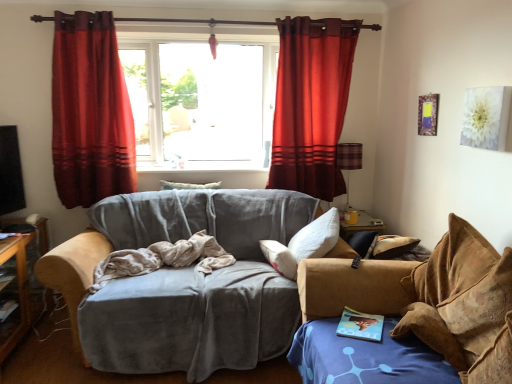
What do you see at coordinates (348, 162) in the screenshot?
I see `plaid fabric lampshade at right` at bounding box center [348, 162].

Where is `white soft pillow at center`? white soft pillow at center is located at coordinates (188, 185).

What is the approximate width of transparent glass window at center?

transparent glass window at center is 8.81 inches in width.

Locate an element on the screen. Image resolution: width=512 pixels, height=384 pixels. plaid fabric lampshade at right is located at coordinates (348, 162).

At what (x,y) coordinates should I click in order to perform the action: click on curtain on the right of transparent glass window at center. Please return your answer as a coordinate pair (x, y). Looking at the image, I should click on (311, 104).

Consider the image. Which of these two, transparent glass window at center or rich red velvet curtain at upper center, positioned as the 2th curtain in left-to-right order, is thinner?

rich red velvet curtain at upper center, positioned as the 2th curtain in left-to-right order, is thinner.

In the scene shown: From the image's perspective, is transparent glass window at center located beneath rich red velvet curtain at upper center, positioned as the 2th curtain in left-to-right order?

No, from the image's perspective, transparent glass window at center is not beneath rich red velvet curtain at upper center, positioned as the 2th curtain in left-to-right order.

In terms of width, does rich red velvet curtain at upper center, acting as the 1th curtain starting from the right, look wider or thinner when compared to velvet gray couch at center, acting as the 1th studio couch starting from the left?

Considering their sizes, rich red velvet curtain at upper center, acting as the 1th curtain starting from the right, looks slimmer than velvet gray couch at center, acting as the 1th studio couch starting from the left.

Is rich red velvet curtain at upper center, acting as the 1th curtain starting from the right, to the left of velvet gray couch at center, acting as the 1th studio couch starting from the left, from the viewer's perspective?

Incorrect, rich red velvet curtain at upper center, acting as the 1th curtain starting from the right, is not on the left side of velvet gray couch at center, acting as the 1th studio couch starting from the left.

Is rich red velvet curtain at upper center, acting as the 1th curtain starting from the right, looking in the opposite direction of velvet gray couch at center, acting as the 1th studio couch starting from the left?

No, rich red velvet curtain at upper center, acting as the 1th curtain starting from the right, is not facing the opposite direction of velvet gray couch at center, acting as the 1th studio couch starting from the left.

Is rich red velvet curtain at upper center, acting as the 1th curtain starting from the right, positioned beyond the bounds of velvet gray couch at center, the second studio couch viewed from the right?

rich red velvet curtain at upper center, acting as the 1th curtain starting from the right, lies outside velvet gray couch at center, the second studio couch viewed from the right,'s area.

Can you tell me how much brown suede studio couch at right, the first studio couch positioned from the right, and velvet gray couch at center, acting as the 1th studio couch starting from the left, differ in facing direction?

They differ by 89.7 degrees in their facing directions.

Considering the sizes of objects brown suede studio couch at right, which is the second studio couch in left-to-right order, and velvet gray couch at center, the second studio couch viewed from the right, in the image provided, who is thinner, brown suede studio couch at right, which is the second studio couch in left-to-right order, or velvet gray couch at center, the second studio couch viewed from the right,?

brown suede studio couch at right, which is the second studio couch in left-to-right order.

Where is `studio couch located in front of the velvet gray couch at center, acting as the 1th studio couch starting from the left`? studio couch located in front of the velvet gray couch at center, acting as the 1th studio couch starting from the left is located at coordinates (429, 299).

Which object is closer to the camera, brown suede studio couch at right, which is the second studio couch in left-to-right order, or velvet gray couch at center, the second studio couch viewed from the right?

Positioned in front is brown suede studio couch at right, which is the second studio couch in left-to-right order.

Consider the image. Which object is positioned more to the right, white soft pillow at center or rich red velvet curtain at upper center, acting as the 1th curtain starting from the right?

rich red velvet curtain at upper center, acting as the 1th curtain starting from the right, is more to the right.

Is white soft pillow at center wider than rich red velvet curtain at upper center, positioned as the 2th curtain in left-to-right order?

No.

Which is behind, point (178, 187) or point (304, 33)?

The point (178, 187) is more distant.

Is beige fabric blanket at center aimed at red velvet curtain at left, arranged as the second curtain when viewed from the right?

No.

Considering the sizes of beige fabric blanket at center and red velvet curtain at left, arranged as the second curtain when viewed from the right, in the image, is beige fabric blanket at center bigger or smaller than red velvet curtain at left, arranged as the second curtain when viewed from the right,?

Clearly, beige fabric blanket at center is smaller in size than red velvet curtain at left, arranged as the second curtain when viewed from the right.

The width and height of the screenshot is (512, 384). I want to click on curtain that is the 1st one when counting upward from the beige fabric blanket at center (from the image's perspective), so click(90, 111).

Does point (431, 255) appear closer or farther from the camera than point (183, 40)?

Clearly, point (431, 255) is closer to the camera than point (183, 40).

From a real-world perspective, who is located higher, brown suede studio couch at right, which is the second studio couch in left-to-right order, or transparent glass window at center?

transparent glass window at center.

In terms of size, does brown suede studio couch at right, which is the second studio couch in left-to-right order, appear bigger or smaller than transparent glass window at center?

brown suede studio couch at right, which is the second studio couch in left-to-right order, is bigger than transparent glass window at center.

How different are the orientations of brown suede studio couch at right, which is the second studio couch in left-to-right order, and transparent glass window at center in degrees?

There is a 88.8-degree angle between the facing directions of brown suede studio couch at right, which is the second studio couch in left-to-right order, and transparent glass window at center.

In the image, there is a brown suede studio couch at right, the first studio couch positioned from the right. Where is `material above it (from the image's perspective)`? This screenshot has height=384, width=512. material above it (from the image's perspective) is located at coordinates (162, 259).

Considering the sizes of objects brown suede studio couch at right, which is the second studio couch in left-to-right order, and beige fabric blanket at center in the image provided, who is taller, brown suede studio couch at right, which is the second studio couch in left-to-right order, or beige fabric blanket at center?

brown suede studio couch at right, which is the second studio couch in left-to-right order, is taller.

Is brown suede studio couch at right, the first studio couch positioned from the right, turned away from beige fabric blanket at center?

No, brown suede studio couch at right, the first studio couch positioned from the right,'s orientation is not away from beige fabric blanket at center.

Is brown suede studio couch at right, which is the second studio couch in left-to-right order, far away from beige fabric blanket at center?

Yes, brown suede studio couch at right, which is the second studio couch in left-to-right order, is far from beige fabric blanket at center.

There is a rich red velvet curtain at upper center, positioned as the 2th curtain in left-to-right order. Identify the location of window above it (from a real-world perspective). This screenshot has height=384, width=512. (201, 102).

At what (x,y) coordinates should I click in order to perform the action: click on studio couch that appears on the left of rich red velvet curtain at upper center, acting as the 1th curtain starting from the right. Please return your answer as a coordinate pair (x, y). Looking at the image, I should click on (183, 283).

Looking at the image, which one is located further to brown suede studio couch at right, the first studio couch positioned from the right, red velvet curtain at left, arranged as the second curtain when viewed from the right, or velvet gray couch at center, the second studio couch viewed from the right?

Based on the image, red velvet curtain at left, arranged as the second curtain when viewed from the right, appears to be further to brown suede studio couch at right, the first studio couch positioned from the right.

Looking at this image, when comparing their distances from red velvet curtain at left, arranged as the second curtain when viewed from the right, does velvet gray couch at center, the second studio couch viewed from the right, or plaid fabric lampshade at right seem closer?

The object closer to red velvet curtain at left, arranged as the second curtain when viewed from the right, is velvet gray couch at center, the second studio couch viewed from the right.

Estimate the real-world distances between objects in this image. Which object is further from rich red velvet curtain at upper center, acting as the 1th curtain starting from the right, red velvet curtain at left, marked as the first curtain in a left-to-right arrangement, or velvet gray couch at center, acting as the 1th studio couch starting from the left?

The object further to rich red velvet curtain at upper center, acting as the 1th curtain starting from the right, is red velvet curtain at left, marked as the first curtain in a left-to-right arrangement.

From the image, which object appears to be nearer to red velvet curtain at left, marked as the first curtain in a left-to-right arrangement, velvet gray couch at center, the second studio couch viewed from the right, or beige fabric blanket at center?

Among the two, velvet gray couch at center, the second studio couch viewed from the right, is located nearer to red velvet curtain at left, marked as the first curtain in a left-to-right arrangement.

When comparing their distances from transparent glass window at center, does rich red velvet curtain at upper center, acting as the 1th curtain starting from the right, or beige fabric blanket at center seem closer?

rich red velvet curtain at upper center, acting as the 1th curtain starting from the right, is closer to transparent glass window at center.

In the scene shown: Based on their spatial positions, is white soft pillow at center or beige fabric blanket at center closer to transparent glass window at center?

Based on the image, white soft pillow at center appears to be nearer to transparent glass window at center.

Looking at the image, which one is located closer to rich red velvet curtain at upper center, positioned as the 2th curtain in left-to-right order, beige fabric blanket at center or red velvet curtain at left, arranged as the second curtain when viewed from the right?

beige fabric blanket at center lies closer to rich red velvet curtain at upper center, positioned as the 2th curtain in left-to-right order, than the other object.

Which object lies nearer to the anchor point plaid fabric lampshade at right, red velvet curtain at left, marked as the first curtain in a left-to-right arrangement, or velvet gray couch at center, the second studio couch viewed from the right?

velvet gray couch at center, the second studio couch viewed from the right, is positioned closer to the anchor plaid fabric lampshade at right.

At what (x,y) coordinates should I click in order to perform the action: click on window between white soft pillow at center and plaid fabric lampshade at right in the horizontal direction. Please return your answer as a coordinate pair (x, y). This screenshot has height=384, width=512. Looking at the image, I should click on (201, 102).

Locate an element on the screen. This screenshot has height=384, width=512. window between beige fabric blanket at center and plaid fabric lampshade at right is located at coordinates (201, 102).

Image resolution: width=512 pixels, height=384 pixels. I want to click on material located between brown suede studio couch at right, the first studio couch positioned from the right, and white soft pillow at center in the depth direction, so click(162, 259).

The image size is (512, 384). What are the coordinates of `window situated between white soft pillow at center and rich red velvet curtain at upper center, acting as the 1th curtain starting from the right, from left to right` in the screenshot? It's located at (201, 102).